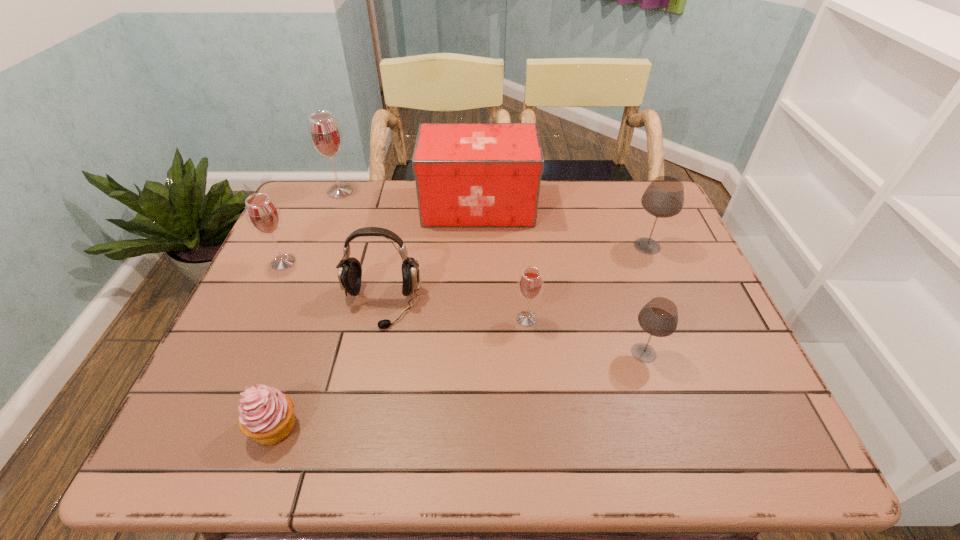
You are a GUI agent. You are given a task and a screenshot of the screen. Output one action in this format:
    pyautogui.click(x=<x>, y=<y>)
    Task: Click on the vacant region located 0.140m on the back of the cupcake
    
    Given the screenshot: What is the action you would take?
    pyautogui.click(x=302, y=347)

Image resolution: width=960 pixels, height=540 pixels. Find the location of `wineglass at the far edge`. wineglass at the far edge is located at coordinates (325, 135).

Image resolution: width=960 pixels, height=540 pixels. I want to click on the first-aid kit present at the far edge, so click(x=467, y=174).

The height and width of the screenshot is (540, 960). What are the coordinates of `object that is at the near edge` in the screenshot? It's located at (266, 415).

Locate an element on the screen. The height and width of the screenshot is (540, 960). cupcake positioned at the left edge is located at coordinates (266, 415).

The width and height of the screenshot is (960, 540). Find the location of `object at the right edge`. object at the right edge is located at coordinates (664, 197).

I want to click on object that is at the far left corner, so click(325, 135).

The width and height of the screenshot is (960, 540). In order to click on object positioned at the near left corner in this screenshot , I will do `click(266, 415)`.

Where is `free region at the far edge`? This screenshot has width=960, height=540. free region at the far edge is located at coordinates (372, 181).

The width and height of the screenshot is (960, 540). I want to click on free spot at the near edge of the desktop, so click(x=413, y=440).